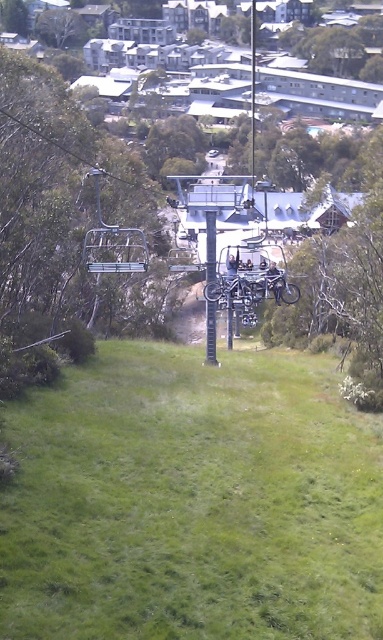
Who is higher up, smooth bark tree at lower right or green leafy tree at upper left?

green leafy tree at upper left is above.

Does smooth bark tree at lower right have a lesser width compared to green leafy tree at upper left?

Incorrect, smooth bark tree at lower right's width is not less than green leafy tree at upper left's.

Find the location of a particular element. The height and width of the screenshot is (640, 383). smooth bark tree at lower right is located at coordinates (343, 285).

The image size is (383, 640). I want to click on smooth bark tree at lower right, so click(x=343, y=285).

Based on the photo, can you confirm if metallic pole at center is taller than metallic silver skis at center?

Incorrect, metallic pole at center's height is not larger of metallic silver skis at center's.

Find the location of a particular element. metallic pole at center is located at coordinates (209, 289).

Which of these two, metallic silver bicycle at center or metallic silver ski lift at center, stands shorter?

metallic silver ski lift at center

Is point (207, 291) positioned before point (96, 248)?

Yes, it is.

Which is behind, point (212, 301) or point (119, 243)?

The point (119, 243) is behind.

Image resolution: width=383 pixels, height=640 pixels. In order to click on metallic silver bicycle at center in this screenshot , I will do `click(252, 276)`.